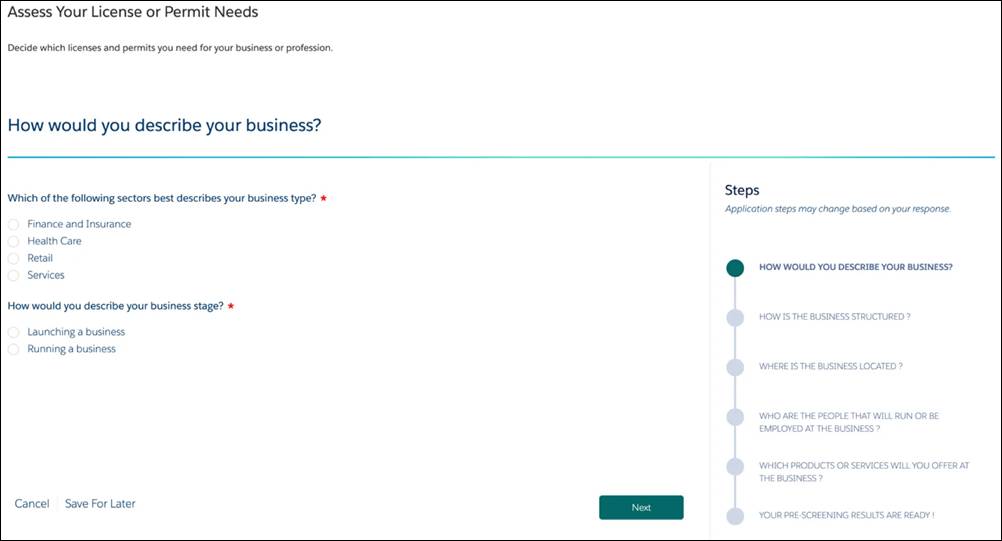
You are a GUI agent. You are given a task and a screenshot of the screen. Output one action in this format:
    pyautogui.click(x=<x>, y=<y>)
    Task: Click on the box
    Image resolution: width=1002 pixels, height=541 pixels.
    Given the screenshot: What is the action you would take?
    pyautogui.click(x=618, y=514)